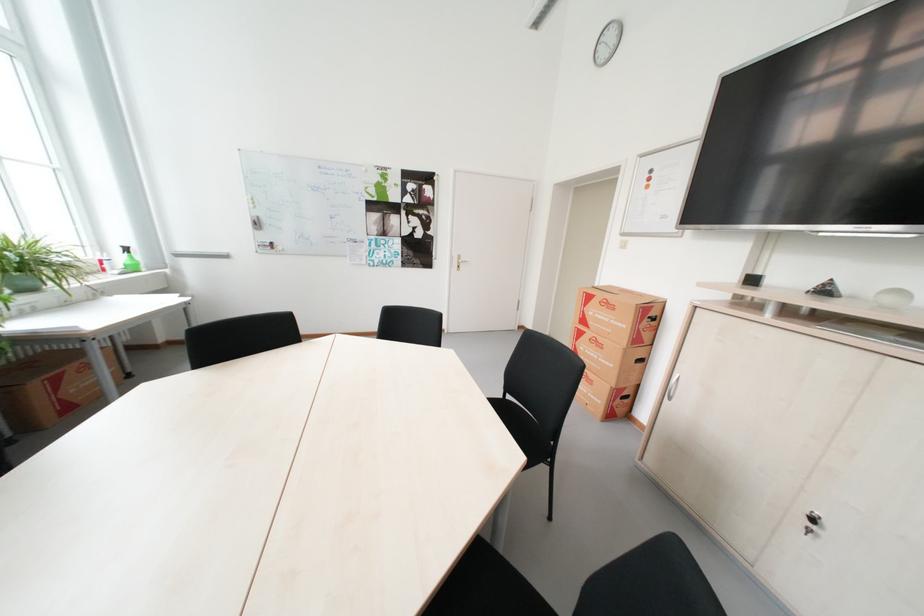
This screenshot has width=924, height=616. Describe the element at coordinates (672, 387) in the screenshot. I see `a cabinet door handle` at that location.